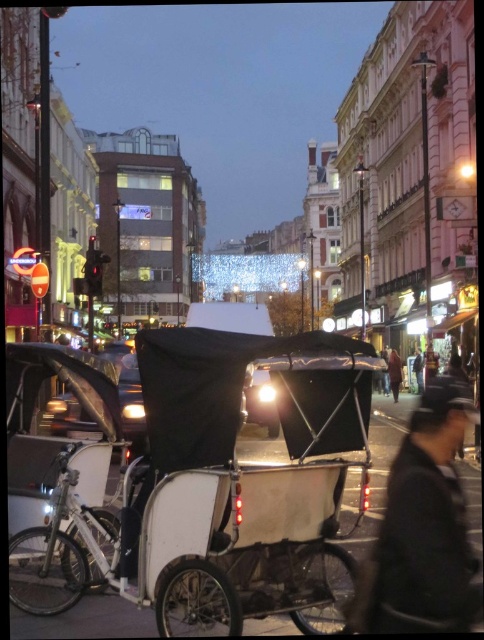
Based on the photo, who is higher up, white matte rickshaw at center or black matte coach at center?

black matte coach at center

Where is `white matte rickshaw at center`? white matte rickshaw at center is located at coordinates (192, 480).

Is point (450, 429) closer to viewer compared to point (417, 385)?

Yes, point (450, 429) is closer to viewer.

In the scene shown: Is black matte coach at center below dark gray coat at center?

Yes, black matte coach at center is below dark gray coat at center.

Between point (437, 401) and point (418, 378), which one is positioned in front?

Point (437, 401) is in front.

Where is `black matte coach at center`? black matte coach at center is located at coordinates (422, 529).

Which is in front, point (208, 403) or point (422, 365)?

Positioned in front is point (208, 403).

Find the location of a particular element. The height and width of the screenshot is (640, 484). white matte rickshaw at center is located at coordinates (192, 480).